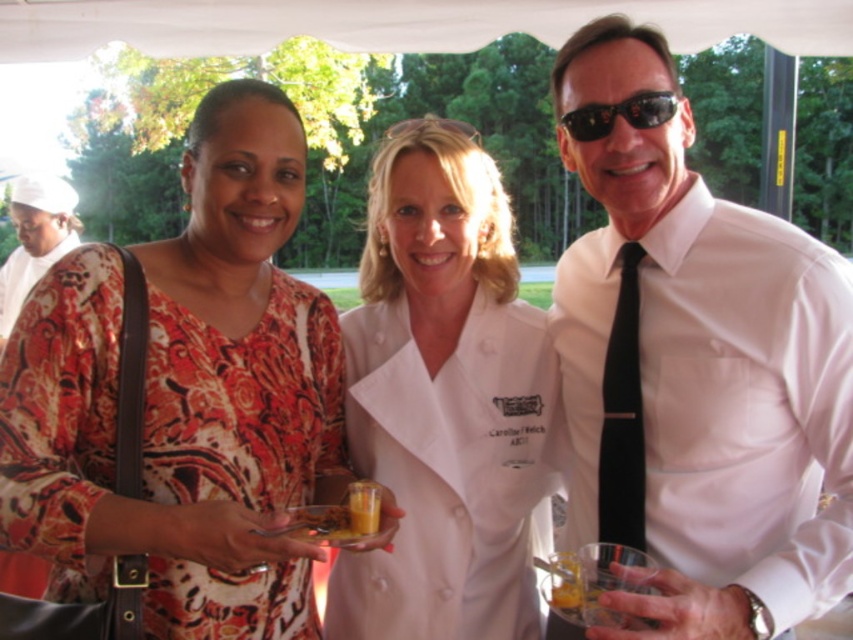
Is printed silk blouse at center positioned at the back of translucent glass cup at center?

No, printed silk blouse at center is in front of translucent glass cup at center.

Between printed silk blouse at center and translucent glass cup at center, which one is positioned lower?

translucent glass cup at center

Between point (140, 305) and point (370, 524), which one is positioned behind?

The point (140, 305) is more distant.

Locate an element on the screen. The height and width of the screenshot is (640, 853). printed silk blouse at center is located at coordinates (181, 403).

The width and height of the screenshot is (853, 640). What do you see at coordinates (444, 401) in the screenshot? I see `white chef coat at center` at bounding box center [444, 401].

Can you confirm if white chef coat at center is positioned to the right of black plastic sunglasses at upper right?

No, white chef coat at center is not to the right of black plastic sunglasses at upper right.

Describe the element at coordinates (444, 401) in the screenshot. I see `white chef coat at center` at that location.

Locate an element on the screen. The image size is (853, 640). white chef coat at center is located at coordinates (444, 401).

Does black plastic sunglasses at upper right have a greater height compared to translucent glass cup at center?

No, black plastic sunglasses at upper right is not taller than translucent glass cup at center.

Which is behind, point (665, 113) or point (358, 506)?

The point (665, 113) is behind.

Where is `black plastic sunglasses at upper right`? black plastic sunglasses at upper right is located at coordinates [619, 115].

Where is `black plastic sunglasses at upper right`? This screenshot has width=853, height=640. black plastic sunglasses at upper right is located at coordinates (619, 115).